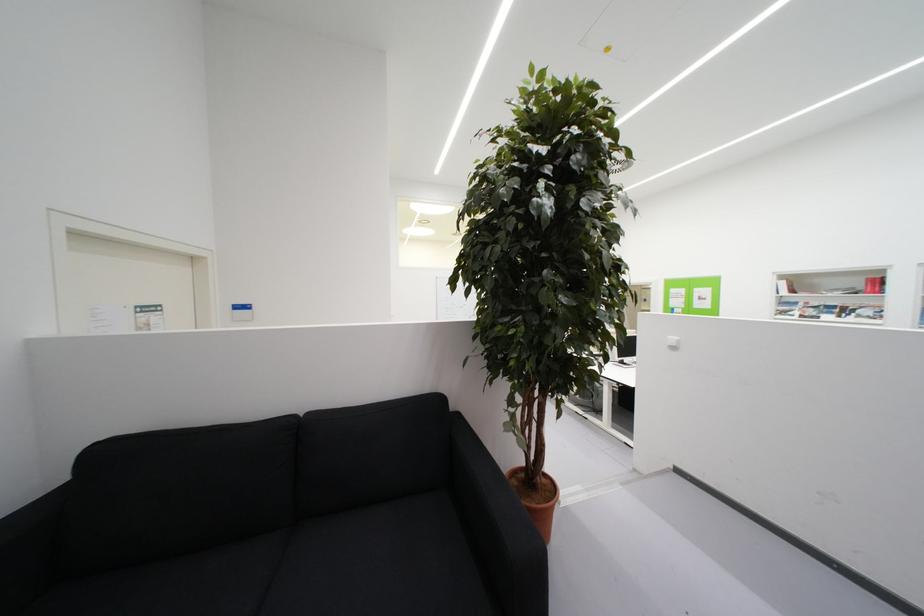
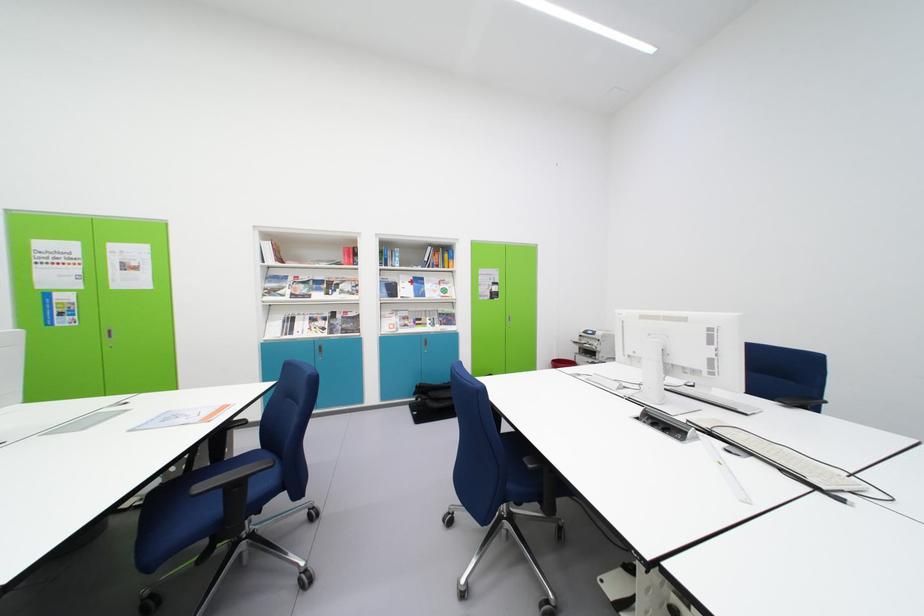
Locate, in the second image, the point that corresponds to point (792, 312) in the first image.

(281, 289)